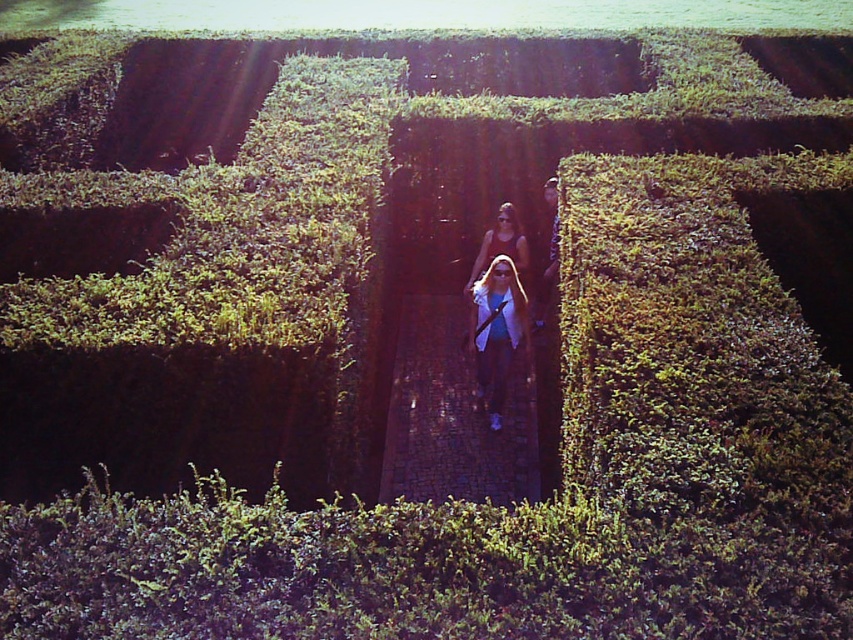
Question: Which point appears farthest from the camera in this image?

Choices:
 (A) (502, 403)
 (B) (498, 227)

Answer: (B)

Question: Which object appears closest to the camera in this image?

Choices:
 (A) matte white jacket at center
 (B) matte black tank top at center

Answer: (A)

Question: Considering the relative positions of matte white jacket at center and matte black tank top at center in the image provided, where is matte white jacket at center located with respect to matte black tank top at center?

Choices:
 (A) right
 (B) left

Answer: (B)

Question: Is matte white jacket at center to the left of matte black tank top at center from the viewer's perspective?

Choices:
 (A) no
 (B) yes

Answer: (B)

Question: Which point is closer to the camera?

Choices:
 (A) matte black tank top at center
 (B) matte white jacket at center

Answer: (B)

Question: Can you confirm if matte white jacket at center is smaller than matte black tank top at center?

Choices:
 (A) yes
 (B) no

Answer: (B)